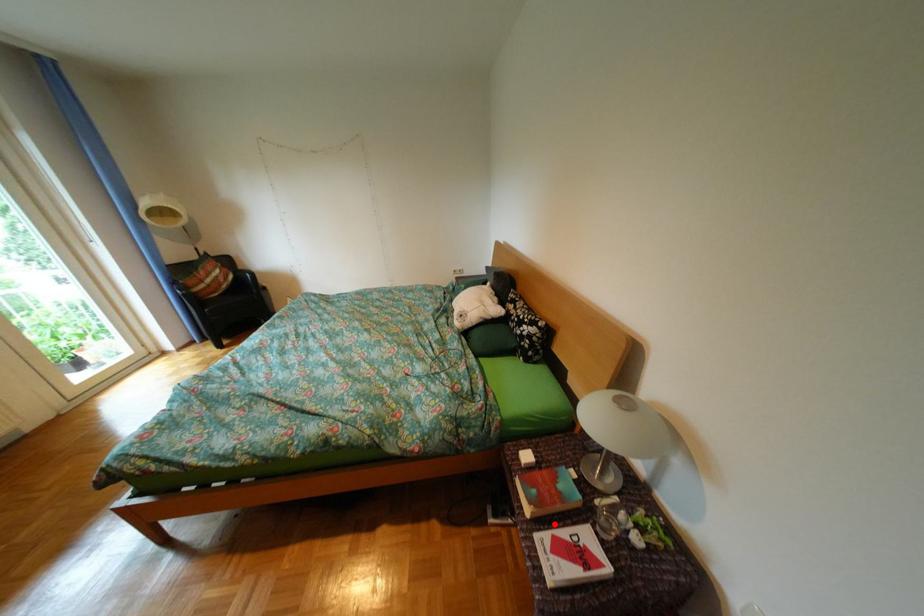
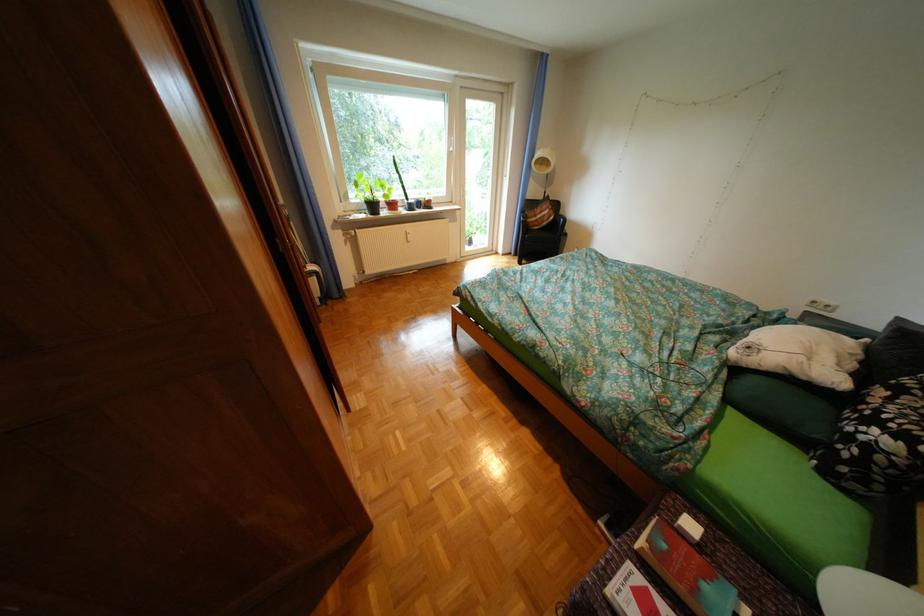
Question: I am providing you with two images of the same scene from different viewpoints. A red point is marked on the first image. Can you still see the location of the red point in image 2?

Choices:
 (A) Yes
 (B) No

Answer: (A)